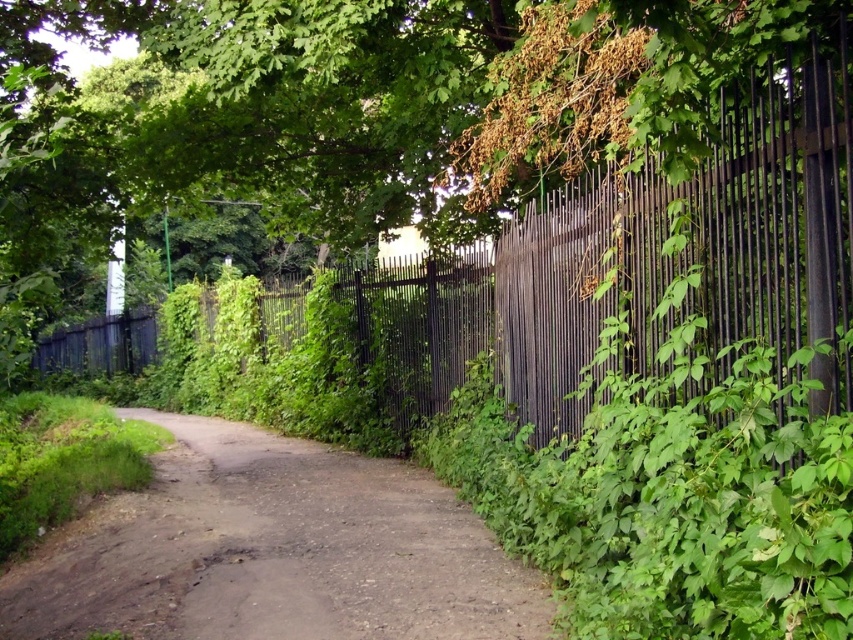
Who is lower down, black metal fence at right or black metal fence at center?

black metal fence at center is lower down.

Is point (811, 337) farther from camera compared to point (125, 340)?

No, it is in front of (125, 340).

Identify the location of black metal fence at right. (693, 243).

Looking at this image, between brown dirt track at center and black metal fence at right, which one appears on the left side from the viewer's perspective?

brown dirt track at center

The height and width of the screenshot is (640, 853). What do you see at coordinates (273, 552) in the screenshot?
I see `brown dirt track at center` at bounding box center [273, 552].

Image resolution: width=853 pixels, height=640 pixels. I want to click on brown dirt track at center, so click(273, 552).

Can you confirm if brown dirt track at center is smaller than black metal fence at center?

Indeed, brown dirt track at center has a smaller size compared to black metal fence at center.

Does point (543, 604) come farther from viewer compared to point (399, 392)?

That is False.

This screenshot has height=640, width=853. Describe the element at coordinates (273, 552) in the screenshot. I see `brown dirt track at center` at that location.

The width and height of the screenshot is (853, 640). I want to click on brown dirt track at center, so click(x=273, y=552).